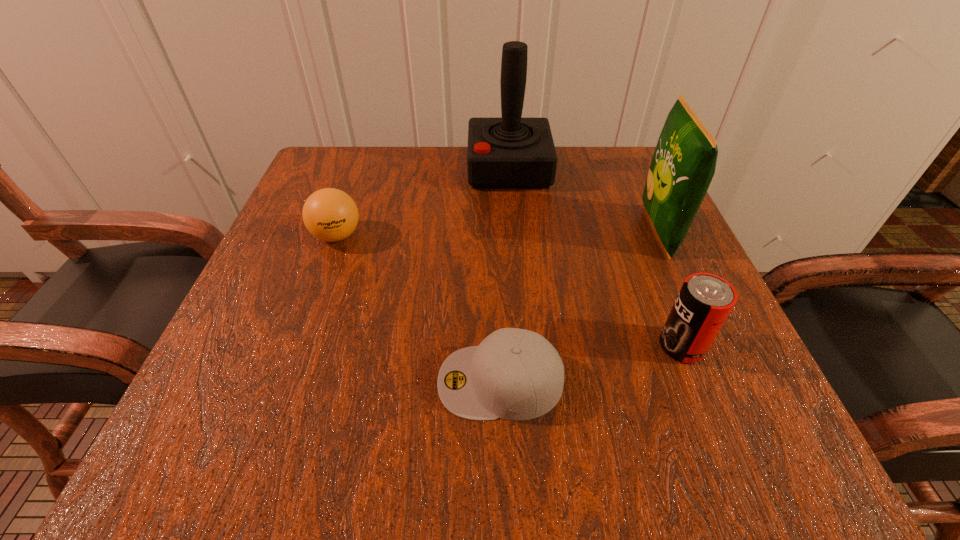
Locate an element on the screen. free area in between the crisp (potato chip) and the second shortest object is located at coordinates (497, 234).

Locate which object is the closest to the joystick. Please provide its 2D coordinates. Your answer should be formatted as a tuple, i.e. [(x, y)], where the tuple contains the x and y coordinates of a point satisfying the conditions above.

[(683, 165)]

The image size is (960, 540). Find the location of `object identified as the third closest to the farthest object`. object identified as the third closest to the farthest object is located at coordinates (704, 302).

The image size is (960, 540). Identify the location of free spot that satisfies the following two spatial constraints: 1. on the front-facing side of the crisp (potato chip); 2. on the side with brand of the leftmost object. (660, 236).

The height and width of the screenshot is (540, 960). I want to click on vacant position in the image that satisfies the following two spatial constraints: 1. on the front-facing side of the crisp (potato chip); 2. on the side with brand of the ping-pong ball, so click(x=660, y=236).